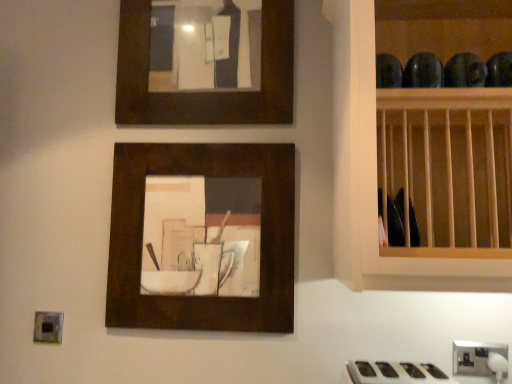
Question: Is the surface of matte brown picture frame at upper center, which ranks as the second picture frame in bottom-to-top order, in direct contact with matte wood picture frame at center, which is counted as the 1th picture frame, starting from the bottom?

Choices:
 (A) no
 (B) yes

Answer: (A)

Question: Is matte brown picture frame at upper center, the 1th picture frame from the top, facing away from matte wood picture frame at center, which is counted as the 1th picture frame, starting from the bottom?

Choices:
 (A) yes
 (B) no

Answer: (B)

Question: Does matte brown picture frame at upper center, the 1th picture frame from the top, have a greater height compared to matte wood picture frame at center, arranged as the 2th picture frame when viewed from the top?

Choices:
 (A) no
 (B) yes

Answer: (A)

Question: From a real-world perspective, is matte brown picture frame at upper center, the 1th picture frame from the top, physically above matte wood picture frame at center, arranged as the 2th picture frame when viewed from the top?

Choices:
 (A) no
 (B) yes

Answer: (B)

Question: Can you confirm if matte brown picture frame at upper center, which ranks as the second picture frame in bottom-to-top order, is positioned to the left of matte wood picture frame at center, which is counted as the 1th picture frame, starting from the bottom?

Choices:
 (A) yes
 (B) no

Answer: (B)

Question: Considering the positions of white glossy gas stove at lower right and satin silver outlet at lower right in the image, is white glossy gas stove at lower right taller or shorter than satin silver outlet at lower right?

Choices:
 (A) short
 (B) tall

Answer: (B)

Question: Based on their sizes in the image, would you say white glossy gas stove at lower right is bigger or smaller than satin silver outlet at lower right?

Choices:
 (A) small
 (B) big

Answer: (B)

Question: From the image's perspective, is white glossy gas stove at lower right above or below satin silver outlet at lower right?

Choices:
 (A) below
 (B) above

Answer: (A)

Question: Do you think white glossy gas stove at lower right is within satin silver outlet at lower right, or outside of it?

Choices:
 (A) inside
 (B) outside

Answer: (B)

Question: Is matte wood picture frame at center, which is counted as the 1th picture frame, starting from the bottom, situated inside matte brown picture frame at upper center, which ranks as the second picture frame in bottom-to-top order, or outside?

Choices:
 (A) inside
 (B) outside

Answer: (B)

Question: Considering the positions of matte wood picture frame at center, arranged as the 2th picture frame when viewed from the top, and matte brown picture frame at upper center, the 1th picture frame from the top, in the image, is matte wood picture frame at center, arranged as the 2th picture frame when viewed from the top, taller or shorter than matte brown picture frame at upper center, the 1th picture frame from the top,?

Choices:
 (A) short
 (B) tall

Answer: (B)

Question: Is matte wood picture frame at center, which is counted as the 1th picture frame, starting from the bottom, wider or thinner than matte brown picture frame at upper center, the 1th picture frame from the top?

Choices:
 (A) wide
 (B) thin

Answer: (B)

Question: From the image's perspective, is matte wood picture frame at center, which is counted as the 1th picture frame, starting from the bottom, located above or below matte brown picture frame at upper center, the 1th picture frame from the top?

Choices:
 (A) below
 (B) above

Answer: (A)

Question: Considering their positions, is white glossy gas stove at lower right located in front of or behind matte wood picture frame at center, which is counted as the 1th picture frame, starting from the bottom?

Choices:
 (A) front
 (B) behind

Answer: (A)

Question: From a real-world perspective, is white glossy gas stove at lower right physically located above or below matte wood picture frame at center, arranged as the 2th picture frame when viewed from the top?

Choices:
 (A) above
 (B) below

Answer: (B)